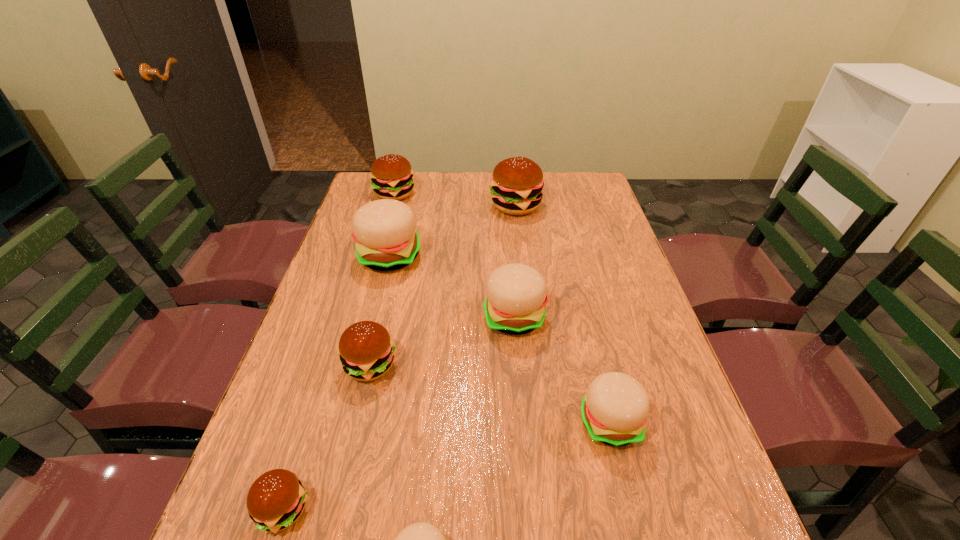
Where is `vacant area that lies between the sixth farthest hamburger and the third farthest hamburger`? This screenshot has height=540, width=960. vacant area that lies between the sixth farthest hamburger and the third farthest hamburger is located at coordinates (499, 339).

Identify the location of free space that is in between the third beige hamburger from left to right and the rightmost brown hamburger. Image resolution: width=960 pixels, height=540 pixels. (516, 261).

Identify the location of object that is the fifth nearest to the sixth farthest object. Image resolution: width=960 pixels, height=540 pixels. (385, 232).

What are the coordinates of `object that ranks as the fifth closest to the second farthest beige hamburger` in the screenshot? It's located at (421, 539).

Point out which hamburger is positioned as the third nearest to the farthest beige hamburger. Please provide its 2D coordinates. Your answer should be formatted as a tuple, i.e. [(x, y)], where the tuple contains the x and y coordinates of a point satisfying the conditions above.

[(516, 187)]

Where is `hamburger that stands as the seventh closest to the third smallest brown hamburger`? The image size is (960, 540). hamburger that stands as the seventh closest to the third smallest brown hamburger is located at coordinates (421, 539).

You are a GUI agent. You are given a task and a screenshot of the screen. Output one action in this format:
    pyautogui.click(x=<x>, y=<y>)
    Task: Click on the third closest brown hamburger to the fourth object from right to left
    
    Given the screenshot: What is the action you would take?
    pyautogui.click(x=516, y=187)

Identify the location of brown hamburger that is the third nearest to the biggest brown hamburger. (276, 499).

Identify which beige hamburger is the second closest to the third beige hamburger from left to right. Please provide its 2D coordinates. Your answer should be formatted as a tuple, i.e. [(x, y)], where the tuple contains the x and y coordinates of a point satisfying the conditions above.

[(385, 232)]

Image resolution: width=960 pixels, height=540 pixels. I want to click on beige hamburger that is the third nearest to the farthest beige hamburger, so click(x=421, y=539).